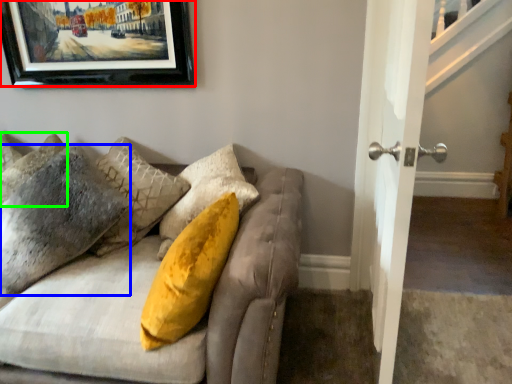
Question: Which object is the farthest from picture frame (highlighted by a red box)? Choose among these: pillow (highlighted by a blue box) or pillow (highlighted by a green box).

Choices:
 (A) pillow
 (B) pillow

Answer: (A)